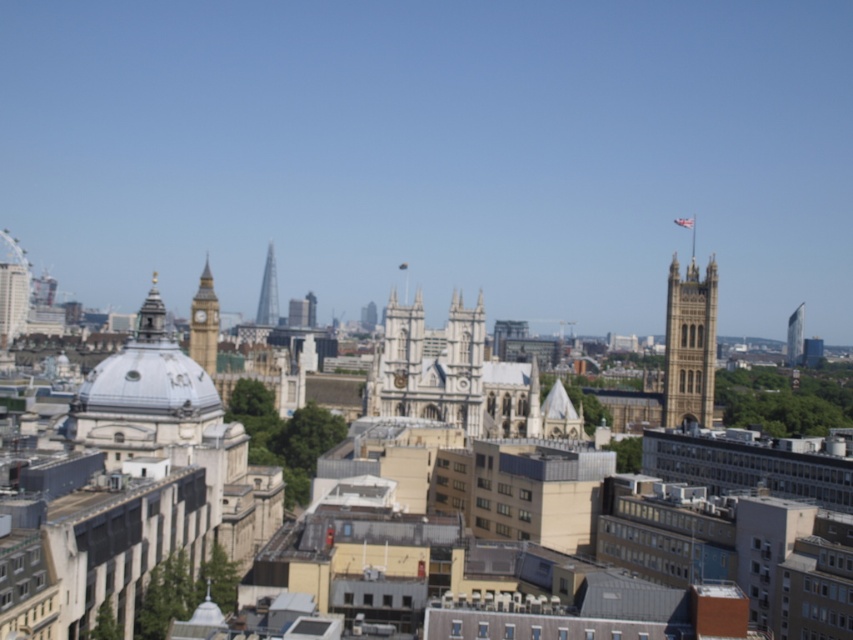
Can you confirm if golden stone tower at upper right is positioned above glassy reflective tower at upper right?

Incorrect, golden stone tower at upper right is not positioned above glassy reflective tower at upper right.

Between golden stone tower at upper right and glassy reflective tower at upper right, which one appears on the right side from the viewer's perspective?

From the viewer's perspective, glassy reflective tower at upper right appears more on the right side.

Which is behind, point (680, 314) or point (801, 314)?

Positioned behind is point (801, 314).

What are the coordinates of `golden stone tower at upper right` in the screenshot? It's located at (689, 344).

Does glassy steel tower at center have a greater height compared to glassy reflective tower at upper right?

Correct, glassy steel tower at center is much taller as glassy reflective tower at upper right.

Which is more to the right, glassy steel tower at center or glassy reflective tower at upper right?

Positioned to the right is glassy reflective tower at upper right.

Is point (271, 248) positioned in front of point (788, 364)?

Yes, point (271, 248) is closer to viewer.

At what (x,y) coordinates should I click in order to perform the action: click on glassy steel tower at center. Please return your answer as a coordinate pair (x, y). The height and width of the screenshot is (640, 853). Looking at the image, I should click on (268, 291).

Measure the distance between point (699, 289) and camera.

Point (699, 289) and camera are 310.01 meters apart.

Does point (685, 289) come closer to viewer compared to point (276, 323)?

Yes, point (685, 289) is in front of point (276, 323).

I want to click on golden stone tower at upper right, so tap(689, 344).